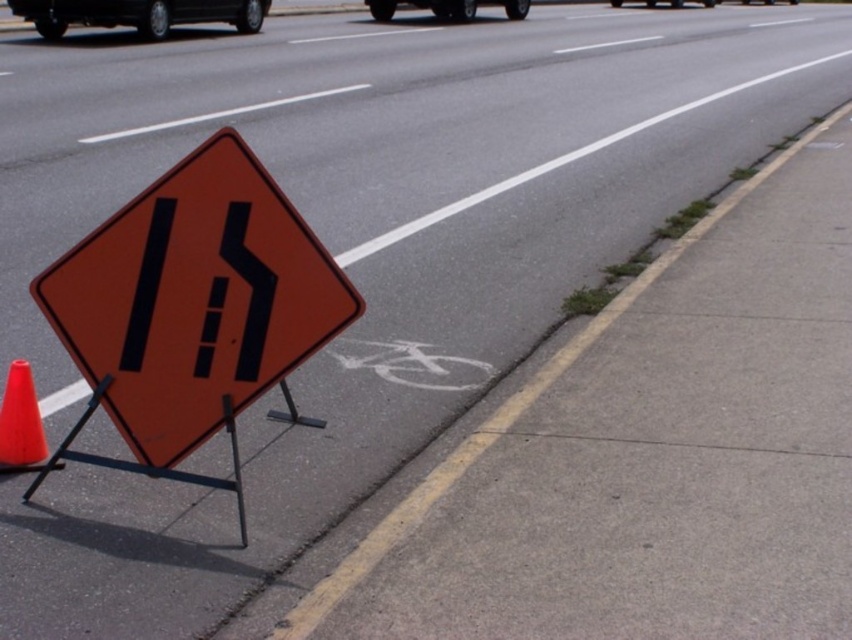
You are a driver approaching the orange traffic sign on the highway. There are two points marked on your GPS navigation screen at coordinates point (354,346) and point (389,3). Based on the scene, which point is closer to the traffic sign?

Point (354,346) is in front of point (389,3), so it is closer to the traffic sign.

You are a cyclist approaching the intersection and see the white painted bike lane at lower center and the metallic silver car at upper center. Can you safely pass between them without entering the car lane?

The distance between the white painted bike lane at lower center and the metallic silver car at upper center is 81.13 feet, which is sufficient for a cyclist to safely pass between them without entering the car lane.